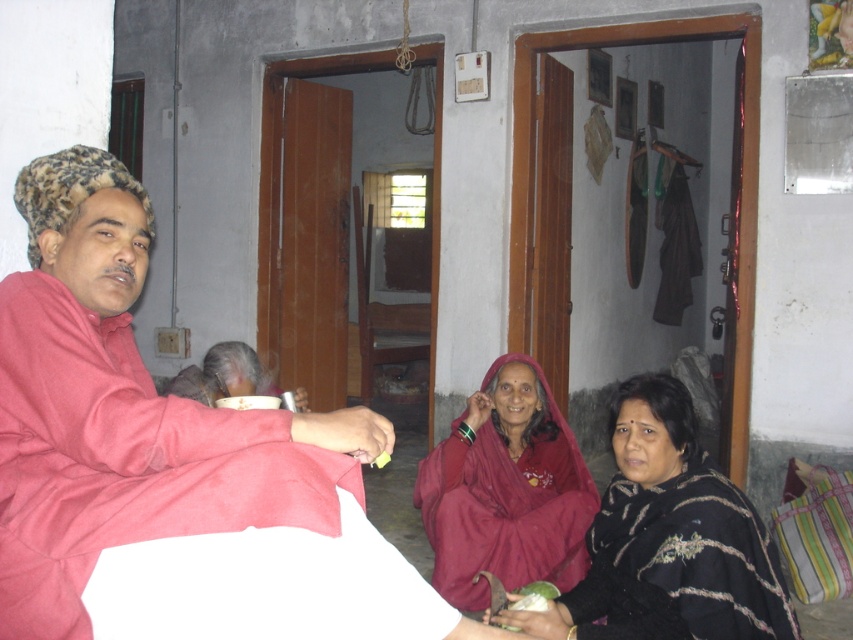
Question: Which of the following is the closest to the observer?

Choices:
 (A) (38, 496)
 (B) (730, 596)
 (C) (434, 483)

Answer: (A)

Question: Observing the image, what is the correct spatial positioning of red cotton kurta at left in reference to maroon fabric shawl at center?

Choices:
 (A) above
 (B) below

Answer: (A)

Question: Can you confirm if red cotton kurta at left is bigger than maroon fabric shawl at center?

Choices:
 (A) no
 (B) yes

Answer: (B)

Question: Based on their relative distances, which object is nearer to the maroon fabric shawl at center?

Choices:
 (A) red cotton kurta at left
 (B) black textured shawl at lower right

Answer: (B)

Question: Which of the following is the farthest from the observer?

Choices:
 (A) (21, 472)
 (B) (747, 627)

Answer: (B)

Question: Can you confirm if red cotton kurta at left is smaller than black textured shawl at lower right?

Choices:
 (A) yes
 (B) no

Answer: (B)